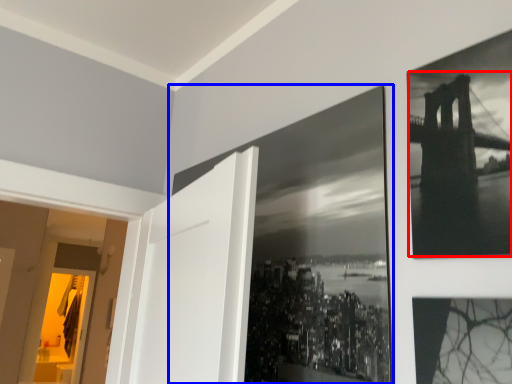
Question: Which of the following is the closest to the observer, Golden Gate Bridge (highlighted by a red box) or picture frame (highlighted by a blue box)?

Choices:
 (A) Golden Gate Bridge
 (B) picture frame

Answer: (A)